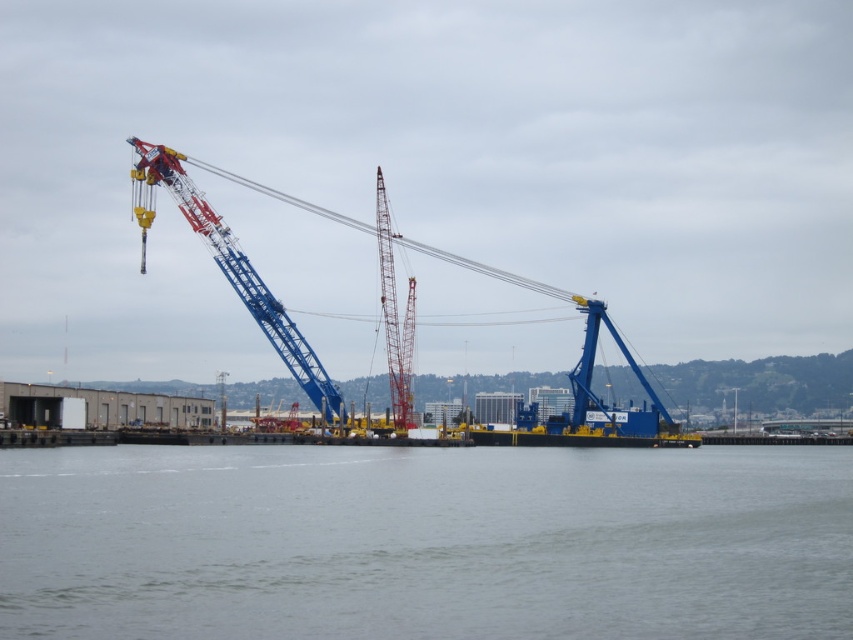
Question: Which point is closer to the camera taking this photo?

Choices:
 (A) (573, 368)
 (B) (386, 332)

Answer: (B)

Question: Does blue metallic crane at center appear on the left side of metallic blue crane at center?

Choices:
 (A) no
 (B) yes

Answer: (A)

Question: Which of the following is the farthest from the observer?

Choices:
 (A) metallic blue crane at center
 (B) red painted metal crane at center
 (C) gray water at center
 (D) blue metallic crane at center

Answer: (D)

Question: Can you confirm if metallic blue crane at center is positioned to the left of red painted metal crane at center?

Choices:
 (A) no
 (B) yes

Answer: (B)

Question: Which of the following is the farthest from the observer?

Choices:
 (A) (376, 205)
 (B) (392, 392)
 (C) (292, 324)

Answer: (A)

Question: Can you confirm if gray water at center is wider than blue metallic crane at center?

Choices:
 (A) yes
 (B) no

Answer: (A)